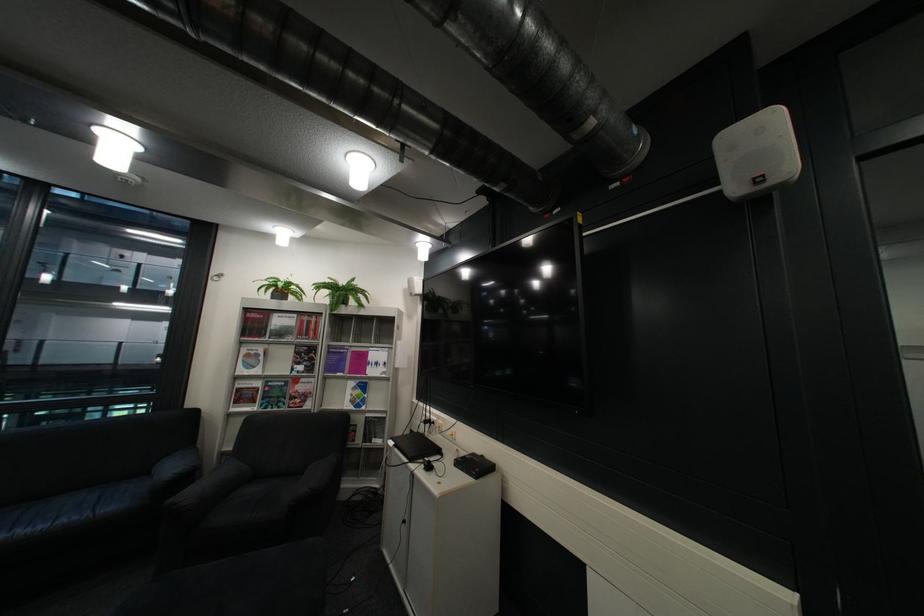
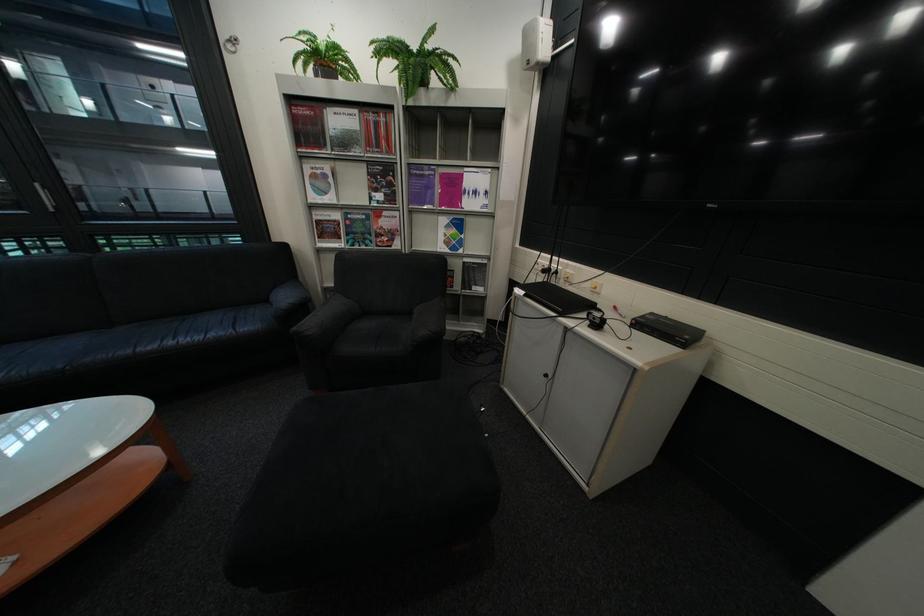
In the second image, find the point that corresponds to (x=359, y=283) in the first image.

(430, 46)